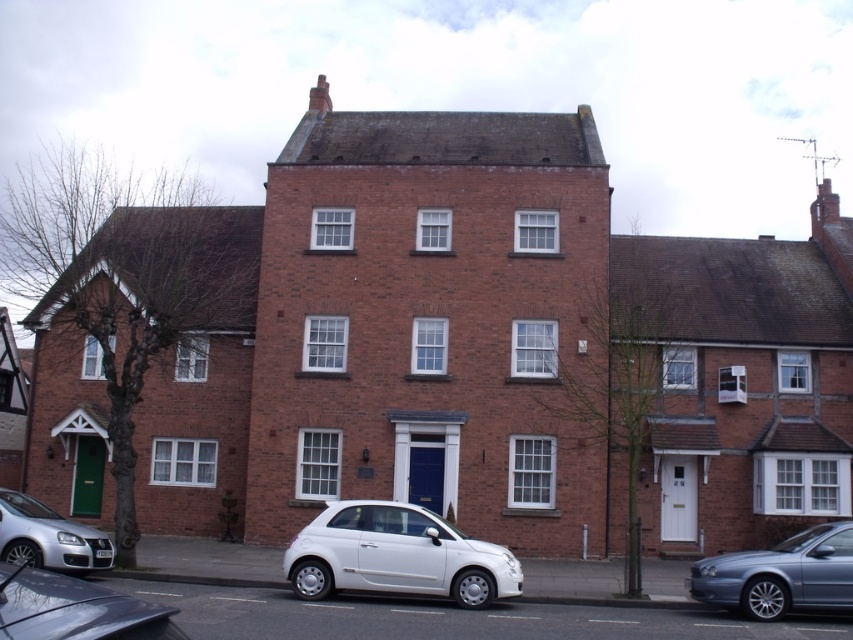
You are driving a car that is 4 meters long and need to park between the white matte hatchback at center and the metallic gray hatchback at lower left. Can your car fit in the space between them?

The distance between the white matte hatchback at center and the metallic gray hatchback at lower left is 7.61 meters. Since your car is 4 meters long, there is sufficient space for it to fit between them.

You are a delivery driver needing to park your vehicle between the two cars in the scene. The white matte hatchback at center and the metallic gray sedan at lower right are parked on the same side of the street. Which car should you park next to if you want to maximize the remaining space for another vehicle?

The white matte hatchback at center is wider than the metallic gray sedan at lower right. Therefore, parking next to the metallic gray sedan at lower right would leave more space for another vehicle since it occupies less width.